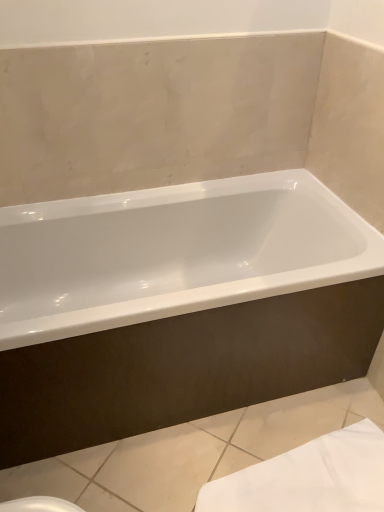
This screenshot has width=384, height=512. In order to click on white fabric towel at lower right in this screenshot , I will do `click(308, 477)`.

What do you see at coordinates (308, 477) in the screenshot? I see `white fabric towel at lower right` at bounding box center [308, 477].

Measure the distance between white fabric towel at lower right and camera.

A distance of 4.15 feet exists between white fabric towel at lower right and camera.

What is the approximate width of white glossy bathtub at center?

white glossy bathtub at center is 28.19 inches wide.

The height and width of the screenshot is (512, 384). What do you see at coordinates (178, 306) in the screenshot?
I see `white glossy bathtub at center` at bounding box center [178, 306].

You are a GUI agent. You are given a task and a screenshot of the screen. Output one action in this format:
    pyautogui.click(x=<x>, y=<y>)
    Task: Click on the white glossy bathtub at center
    The image size is (384, 512).
    Given the screenshot: What is the action you would take?
    pyautogui.click(x=178, y=306)

In order to click on white fabric towel at lower right in this screenshot , I will do `click(308, 477)`.

Is white fabric towel at lower right at the left side of white glossy bathtub at center?

No, white fabric towel at lower right is not to the left of white glossy bathtub at center.

Is white fabric towel at lower right further to camera compared to white glossy bathtub at center?

That is True.

Between point (222, 492) and point (7, 465), which one is positioned in front?

The point (222, 492) is closer to the camera.

From the image's perspective, between white fabric towel at lower right and white glossy bathtub at center, which one is located above?

white glossy bathtub at center is shown above in the image.

From a real-world perspective, is white fabric towel at lower right physically located above or below white glossy bathtub at center?

white fabric towel at lower right is below white glossy bathtub at center.

Considering the sizes of white fabric towel at lower right and white glossy bathtub at center in the image, is white fabric towel at lower right wider or thinner than white glossy bathtub at center?

In the image, white fabric towel at lower right appears to be more narrow than white glossy bathtub at center.

Which of these two, white fabric towel at lower right or white glossy bathtub at center, stands shorter?

white fabric towel at lower right is shorter.

Considering the sizes of objects white fabric towel at lower right and white glossy bathtub at center in the image provided, who is bigger, white fabric towel at lower right or white glossy bathtub at center?

white glossy bathtub at center is bigger.

Could white glossy bathtub at center be considered to be inside white fabric towel at lower right?

No.

Are white fabric towel at lower right and white glossy bathtub at center located far from each other?

No, white fabric towel at lower right is not far from white glossy bathtub at center.

Is white fabric towel at lower right positioned with its back to white glossy bathtub at center?

No, white glossy bathtub at center is not at the back of white fabric towel at lower right.

Can you tell me how much white fabric towel at lower right and white glossy bathtub at center differ in facing direction?

white fabric towel at lower right and white glossy bathtub at center are facing 0.00104 degrees away from each other.

This screenshot has height=512, width=384. There is a white fabric towel at lower right. What are the coordinates of `bathtub above it (from a real-world perspective)` in the screenshot? It's located at (178, 306).

Is white glossy bathtub at center at the left side of white fabric towel at lower right?

Yes, white glossy bathtub at center is to the left of white fabric towel at lower right.

Considering the positions of objects white glossy bathtub at center and white fabric towel at lower right in the image provided, who is behind, white glossy bathtub at center or white fabric towel at lower right?

white fabric towel at lower right is further from the camera.

Which is behind, point (33, 315) or point (344, 452)?

Positioned behind is point (33, 315).

Based on the photo, from the image's perspective, which one is positioned higher, white glossy bathtub at center or white fabric towel at lower right?

white glossy bathtub at center appears higher in the image.

From a real-world perspective, does white glossy bathtub at center stand above white fabric towel at lower right?

Yes.

Considering the relative sizes of white glossy bathtub at center and white fabric towel at lower right in the image provided, is white glossy bathtub at center wider than white fabric towel at lower right?

Correct, the width of white glossy bathtub at center exceeds that of white fabric towel at lower right.

In terms of height, does white glossy bathtub at center look taller or shorter compared to white fabric towel at lower right?

Considering their sizes, white glossy bathtub at center has more height than white fabric towel at lower right.

Does white glossy bathtub at center have a smaller size compared to white fabric towel at lower right?

No.

Is white glossy bathtub at center positioned beyond the bounds of white fabric towel at lower right?

Absolutely, white glossy bathtub at center is external to white fabric towel at lower right.

Is white glossy bathtub at center far away from white fabric towel at lower right?

That's not correct — white glossy bathtub at center is a little close to white fabric towel at lower right.

Is white glossy bathtub at center aimed at white fabric towel at lower right?

Yes, white glossy bathtub at center is facing white fabric towel at lower right.

From the picture: How distant is white glossy bathtub at center from white fabric towel at lower right?

white glossy bathtub at center is 21.39 inches away from white fabric towel at lower right.

Where is `bath towel lying on the right of white glossy bathtub at center`? This screenshot has width=384, height=512. bath towel lying on the right of white glossy bathtub at center is located at coordinates (308, 477).

Where is `bath towel that appears below the white glossy bathtub at center (from the image's perspective)`? bath towel that appears below the white glossy bathtub at center (from the image's perspective) is located at coordinates (308, 477).

Find the location of `bath towel that appears below the white glossy bathtub at center (from a real-world perspective)`. bath towel that appears below the white glossy bathtub at center (from a real-world perspective) is located at coordinates (308, 477).